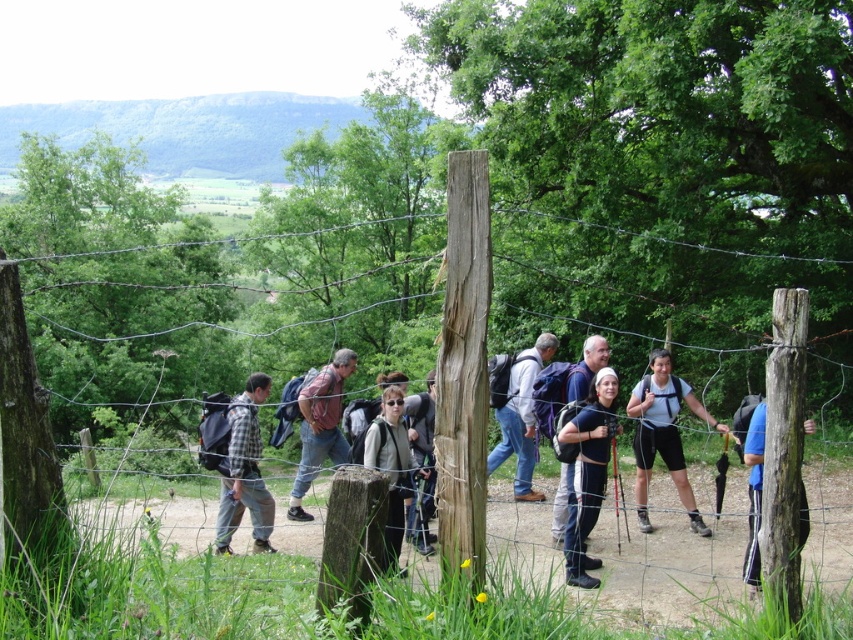
Question: Among these objects, which one is farthest from the camera?

Choices:
 (A) rustic brown backpack at center
 (B) blue fabric backpack at right
 (C) wire mesh fence at center

Answer: (A)

Question: Does light brown leather jacket at center appear on the right side of blue fabric backpack at right?

Choices:
 (A) yes
 (B) no

Answer: (B)

Question: Which of the following is the closest to the observer?

Choices:
 (A) dark gray backpack at center
 (B) wooden post at center
 (C) blue fabric backpack at right

Answer: (B)

Question: Is wire mesh fence at center above black fabric backpack at center?

Choices:
 (A) no
 (B) yes

Answer: (B)

Question: Which point is farther to the camera?

Choices:
 (A) black fabric backpack at center
 (B) blue fabric backpack at right
 (C) denim jeans at center
 (D) plaid fabric shirt at center

Answer: (C)

Question: Can you confirm if black fabric backpack at center is smaller than dark gray backpack at center?

Choices:
 (A) yes
 (B) no

Answer: (A)